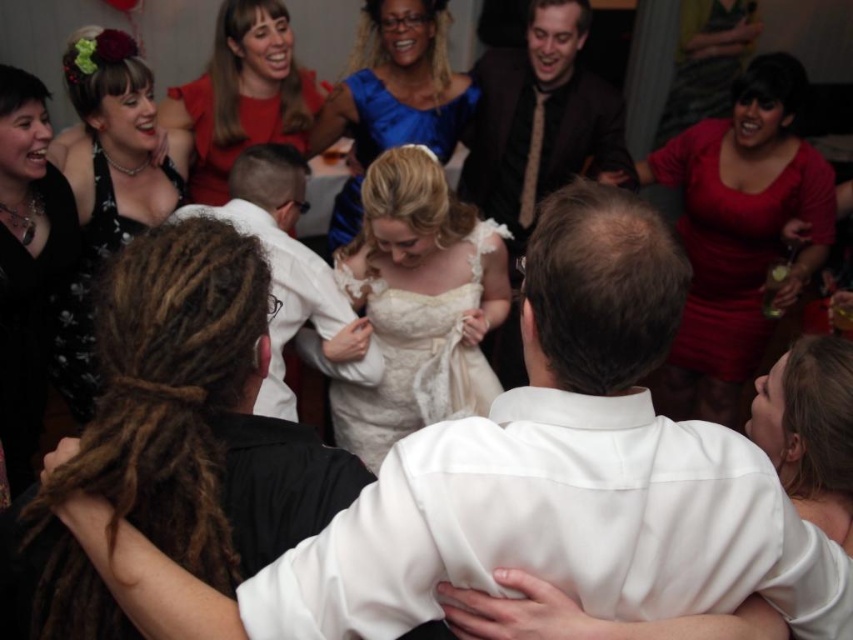
You are a photographer at the wedding reception. You want to capture a photo that includes both the matte brown suit at center and the black lace dress at left. What is the minimum distance you need to move backward to ensure both subjects are in frame?

The minimum distance you need to move backward to ensure both the matte brown suit at center and the black lace dress at left are in frame is 1.62 meters, as they are 1.62 meters apart from each other.